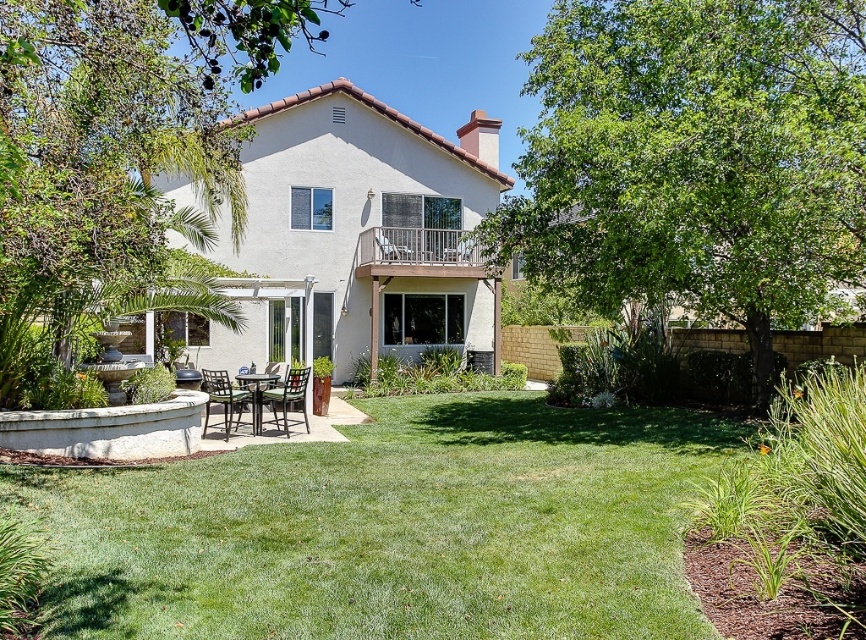
You are standing at the camera position looking at the backyard. There are two points marked in the image, point 1 at coordinates point (333, 577) and point 2 at point (237, 412). Which point is closer to you?

Point (333, 577) is closer to the camera than point (237, 412).

You are standing at the position of point [210,76] and want to walk towards the house. Is the point [642,426] in your path?

The point [642,426] is further to the camera than point [210,76], so if you are standing at point [210,76] and walking towards the house, the point [642,426] would be in your path because it is closer to the camera and thus between you and the house.